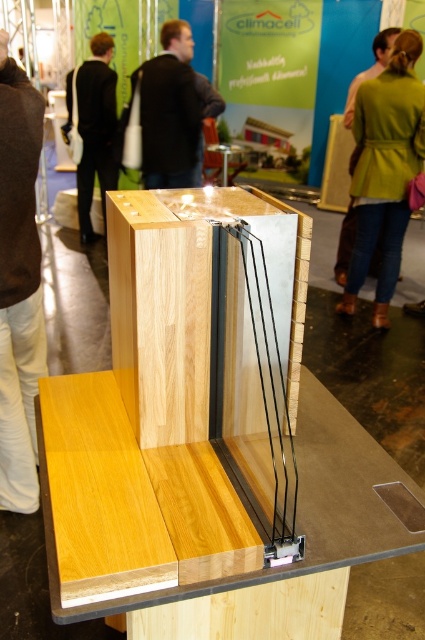
Question: Which point appears closest to the camera in this image?

Choices:
 (A) (135, 444)
 (B) (286, 346)
 (C) (147, 156)

Answer: (A)

Question: Which of the following is the farthest from the observer?

Choices:
 (A) green fabric coat at upper right
 (B) light wood table at center
 (C) natural wood panel at center

Answer: (A)

Question: In this image, where is light wood table at center located relative to brown wool sweater at lower left?

Choices:
 (A) right
 (B) left

Answer: (A)

Question: Can you confirm if light wood table at center is positioned above dark brown leather jacket at upper center?

Choices:
 (A) yes
 (B) no

Answer: (B)

Question: Among these points, which one is farthest from the camera?

Choices:
 (A) [x=82, y=499]
 (B) [x=289, y=304]
 (C) [x=78, y=182]
 (D) [x=28, y=476]

Answer: (C)

Question: Where is light brown wood at center located in relation to black jacket at upper left in the image?

Choices:
 (A) right
 (B) left

Answer: (A)